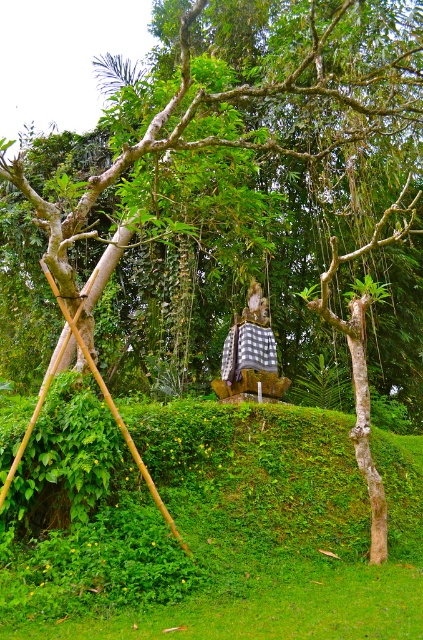
Is point (236, 632) farther from camera compared to point (246, 349)?

No, it is in front of (246, 349).

Can you confirm if green grassy at center is taller than checkered fabric statue at center?

Incorrect, green grassy at center's height is not larger of checkered fabric statue at center's.

The width and height of the screenshot is (423, 640). Identify the location of green grassy at center. (214, 529).